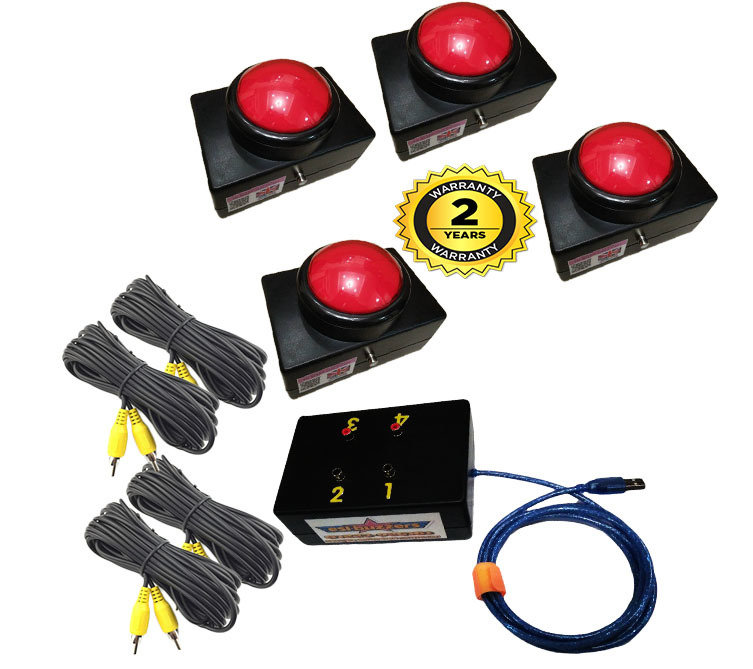
You are a GUI agent. You are given a task and a screenshot of the screen. Output one action in this format:
    pyautogui.click(x=<x>, y=<y>)
    Task: Click on the wire holders
    The image size is (753, 669).
    Given the screenshot: What is the action you would take?
    pyautogui.click(x=491, y=577), pyautogui.click(x=148, y=556), pyautogui.click(x=191, y=512), pyautogui.click(x=130, y=372), pyautogui.click(x=181, y=324)